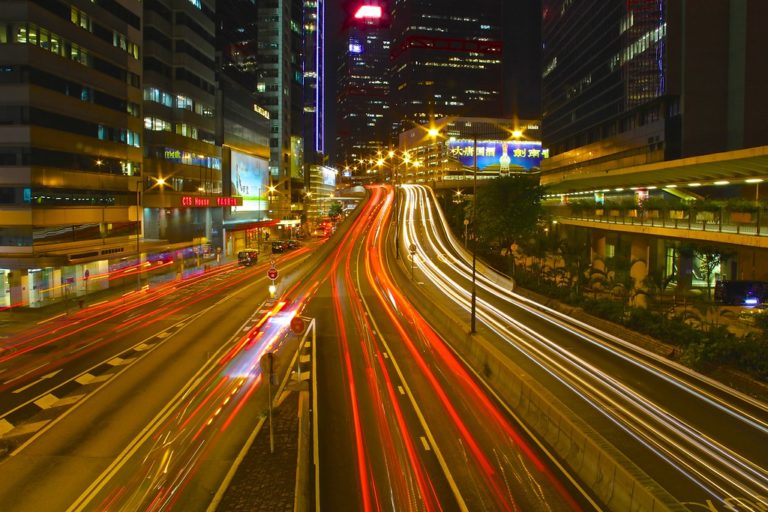
What are the coordinates of `windows` in the screenshot? It's located at (150, 101), (164, 95), (180, 93).